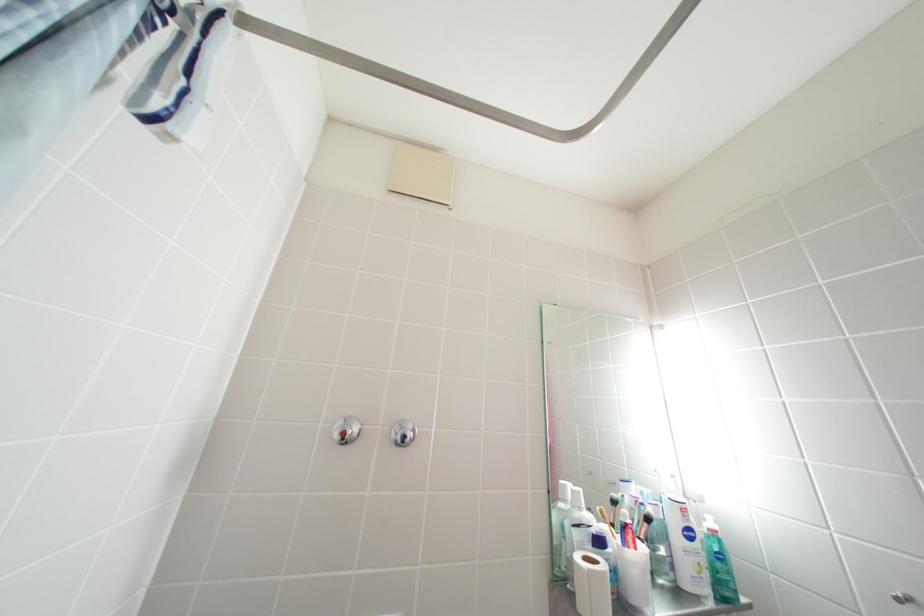
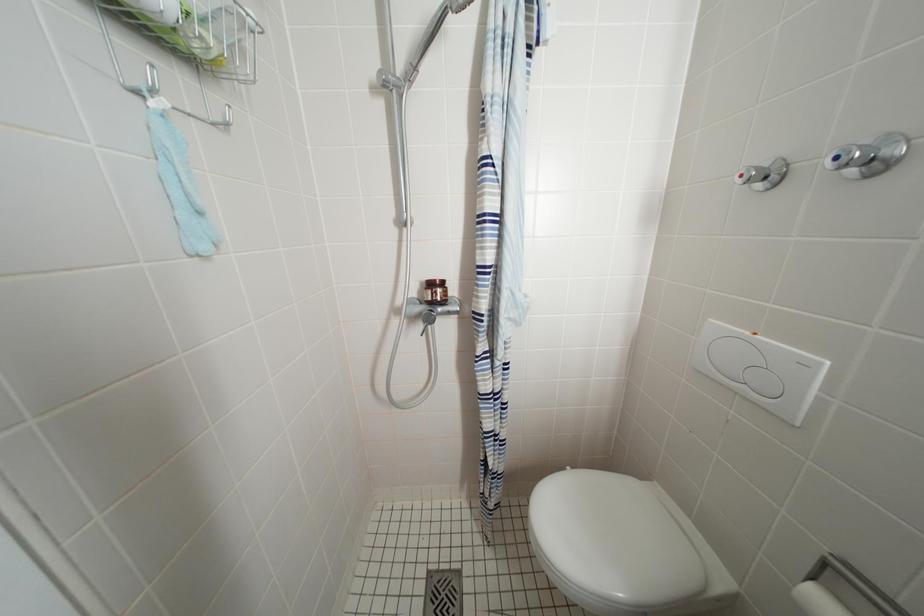
Question: Based on the continuous images, in which direction is the camera rotating? Reply with the corresponding letter.

Choices:
 (A) Left
 (B) Right
 (C) Up
 (D) Down

Answer: (A)